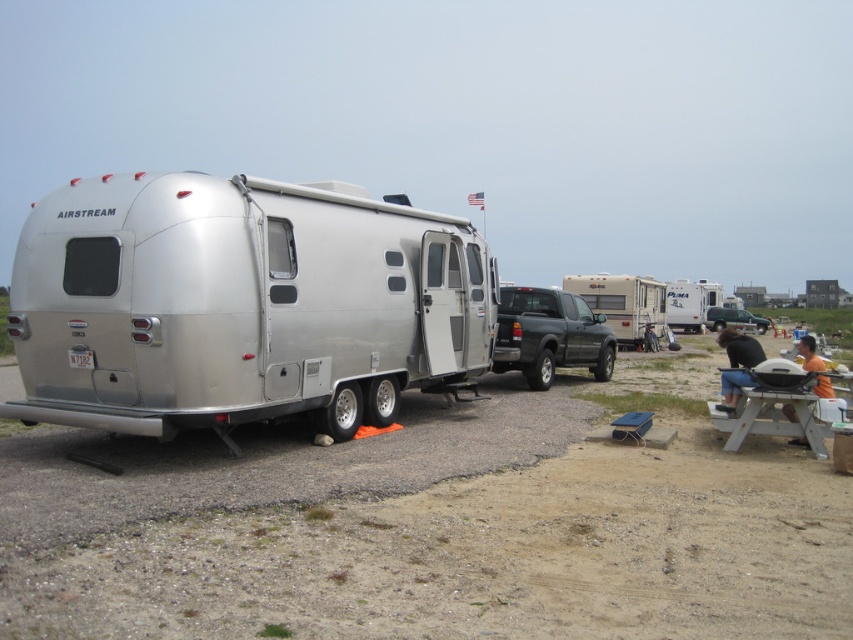
You are planning to set up a tent in the camping area shown. You see a white plastic picnic table at lower right and a metallic silver suv at center. Which object is closer to the ground?

The white plastic picnic table at lower right is closer to the ground because it is positioned below the metallic silver suv at center.

You are at a campground and see the white plastic picnic table at lower right and the orange fabric shirt at lower right. Which object is positioned to the left when viewed from your perspective?

The white plastic picnic table at lower right is to the left of the orange fabric shirt at lower right.

You are a camper who wants to place a 1.5 meter long tent pole horizontally on the white plastic picnic table at lower right. The orange fabric shirt at lower right is currently on the table. Can the tent pole fit on the table without touching the shirt?

The white plastic picnic table at lower right has a lesser height compared to orange fabric shirt at lower right, meaning the shirt is taller than the table. Since the shirt is on the table, the tent pole cannot be placed horizontally without touching it.